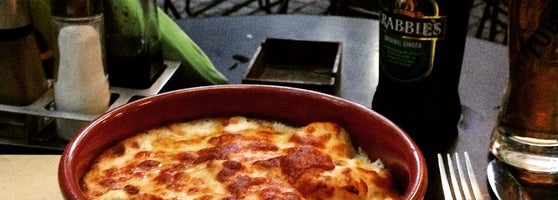
Find the location of a particular element. The width and height of the screenshot is (558, 200). holder for condiments is located at coordinates (128, 93), (48, 114).